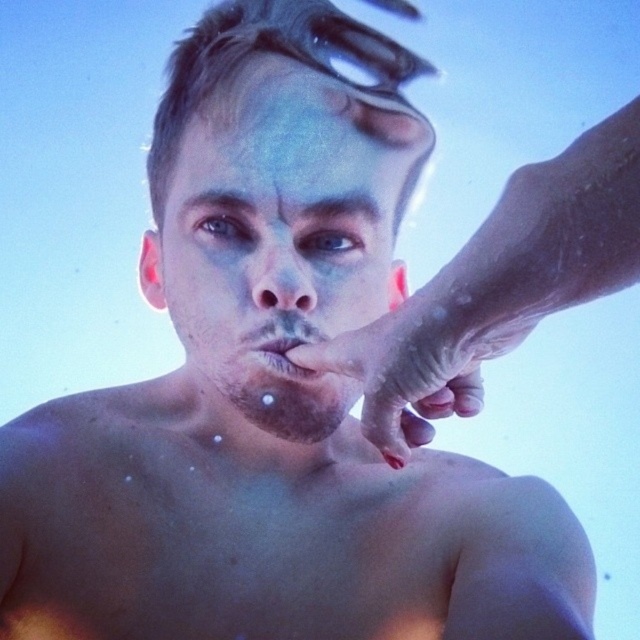
Question: Is shiny metallic forehead at center above transparent plastic goggles at upper center?

Choices:
 (A) yes
 (B) no

Answer: (B)

Question: Is shiny metallic forehead at center below transparent plastic goggles at upper center?

Choices:
 (A) yes
 (B) no

Answer: (A)

Question: In this image, where is dry skin hand at center located relative to shiny metallic forehead at center?

Choices:
 (A) below
 (B) above

Answer: (A)

Question: Which point is farther from the camera taking this photo?

Choices:
 (A) click(x=416, y=310)
 (B) click(x=392, y=8)
 (C) click(x=204, y=120)
 (D) click(x=300, y=250)

Answer: (B)

Question: Estimate the real-world distances between objects in this image. Which object is farther from the shiny metallic forehead at center?

Choices:
 (A) smooth skin nose at center
 (B) dry skin hand at center

Answer: (B)

Question: Among these points, which one is farthest from the camera?

Choices:
 (A) (252, 20)
 (B) (376, 420)
 (C) (260, 413)
 (D) (296, 83)

Answer: (A)